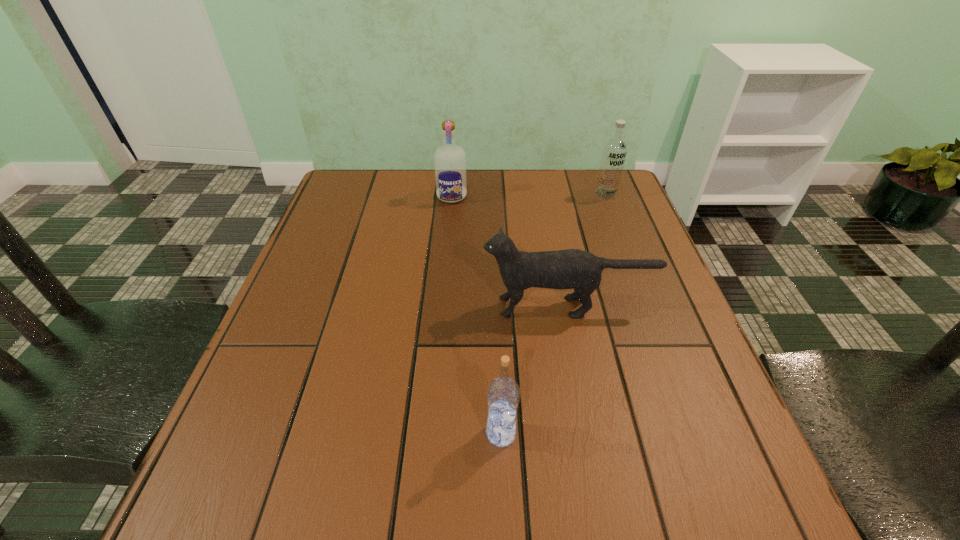
Find the location of a particular element. the leftmost vodka is located at coordinates (449, 159).

Where is `the rightmost vodka`? the rightmost vodka is located at coordinates (614, 151).

This screenshot has width=960, height=540. What are the coordinates of `the nearest vodka` in the screenshot? It's located at (503, 394).

At what (x,y) coordinates should I click in order to perform the action: click on the nearest object. Please return your answer as a coordinate pair (x, y). Image resolution: width=960 pixels, height=540 pixels. Looking at the image, I should click on (503, 394).

The height and width of the screenshot is (540, 960). I want to click on the second nearest object, so click(x=576, y=269).

You are a GUI agent. You are given a task and a screenshot of the screen. Output one action in this format:
    pyautogui.click(x=<x>, y=<y>)
    Task: Click on the vacant space located 0.340m on the label of the leftmost object
    
    Given the screenshot: What is the action you would take?
    coord(444,292)

Locate an element on the screen. The width and height of the screenshot is (960, 540). vacant space positioned 0.280m on the front label of the rightmost vodka is located at coordinates (634, 267).

Find the location of a particular element. free point located on the front of the second vodka from right to left is located at coordinates (504, 515).

At what (x,y) coordinates should I click in order to perform the action: click on vacant space located 0.330m on the front-facing side of the second nearest object. Please return your answer as a coordinate pair (x, y). The height and width of the screenshot is (540, 960). Looking at the image, I should click on (327, 307).

What are the coordinates of `vacant position located on the front-facing side of the second nearest object` in the screenshot? It's located at tap(384, 307).